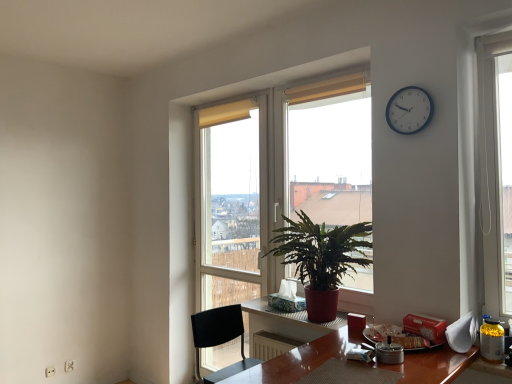
Question: In terms of height, does green leafy plant at center look taller or shorter compared to white plastic clock at upper right?

Choices:
 (A) short
 (B) tall

Answer: (B)

Question: From the image's perspective, is green leafy plant at center above or below white plastic clock at upper right?

Choices:
 (A) below
 (B) above

Answer: (A)

Question: Estimate the real-world distances between objects in this image. Which object is closer to the white plastic clock at upper right?

Choices:
 (A) wooden desk at center
 (B) green leafy plant at center
 (C) black plastic chair at lower center
 (D) transparent glass door at center
 (E) green glossy plant at center

Answer: (B)

Question: Which object is positioned closest to the green glossy plant at center?

Choices:
 (A) white plastic clock at upper right
 (B) black plastic chair at lower center
 (C) green leafy plant at center
 (D) transparent glass door at center
 (E) wooden desk at center

Answer: (E)